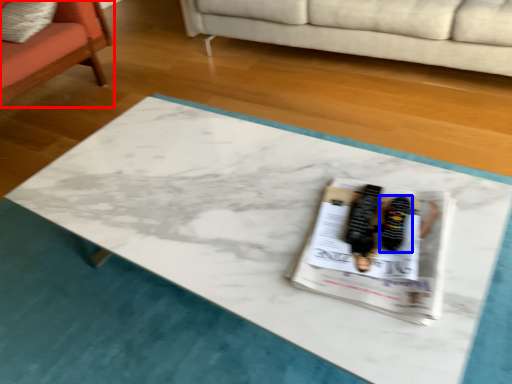
Question: Which point is closer to the camera, chair (highlighted by a red box) or footwear (highlighted by a blue box)?

Choices:
 (A) chair
 (B) footwear

Answer: (B)